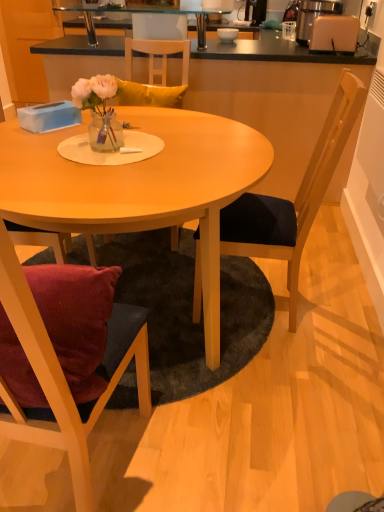
Where is `free point to the right of wooden chair at left, the 2th chair in the right-to-left sequence`? This screenshot has width=384, height=512. free point to the right of wooden chair at left, the 2th chair in the right-to-left sequence is located at coordinates (209, 473).